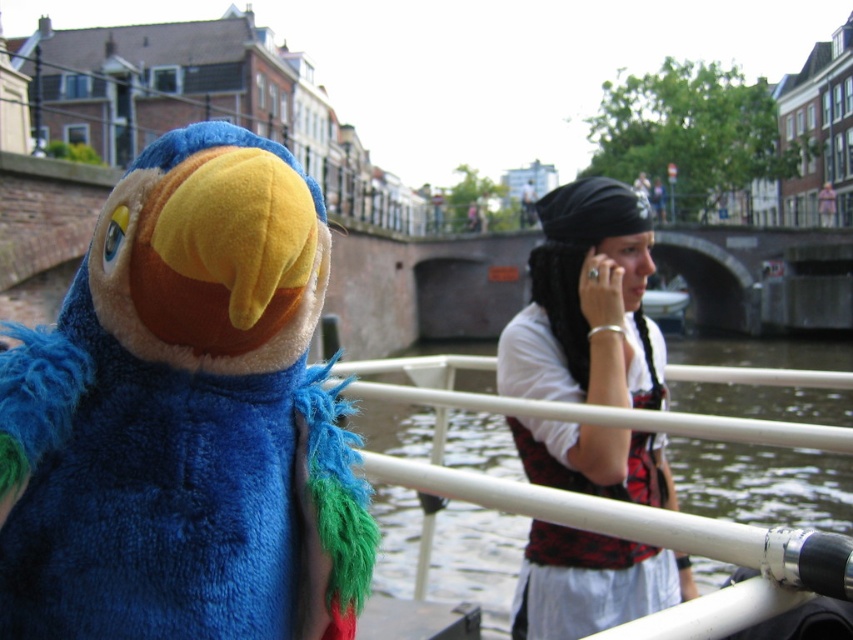
Can you confirm if blue plush parrot at left is wider than matte black vest at center?

In fact, blue plush parrot at left might be narrower than matte black vest at center.

Between blue plush parrot at left and matte black vest at center, which one has less height?

With less height is blue plush parrot at left.

Is point (341, 467) closer to camera compared to point (604, 316)?

Yes.

Locate an element on the screen. The image size is (853, 640). blue plush parrot at left is located at coordinates (184, 417).

Between blue plush parrot at left and green fuzzy water at lower center, which one has more height?

blue plush parrot at left

Does blue plush parrot at left appear over green fuzzy water at lower center?

Yes.

Is point (251, 627) closer to viewer compared to point (491, 493)?

Yes, point (251, 627) is closer to viewer.

At what (x,y) coordinates should I click in order to perform the action: click on blue plush parrot at left. Please return your answer as a coordinate pair (x, y). Image resolution: width=853 pixels, height=640 pixels. Looking at the image, I should click on (184, 417).

Is matte black vest at center behind green fuzzy water at lower center?

Yes.

Does matte black vest at center have a smaller size compared to green fuzzy water at lower center?

No, matte black vest at center is not smaller than green fuzzy water at lower center.

Does point (577, 378) lie in front of point (508, 493)?

No, (577, 378) is further to viewer.

Where is `matte black vest at center`? Image resolution: width=853 pixels, height=640 pixels. matte black vest at center is located at coordinates (585, 304).